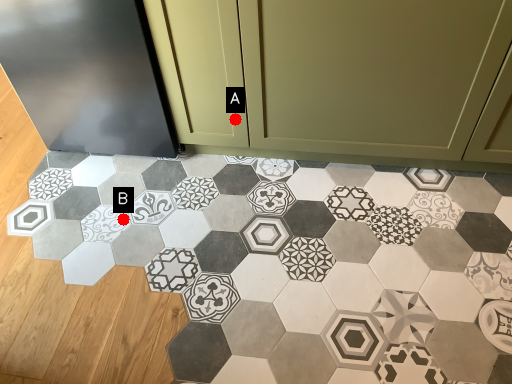
Question: Two points are circled on the image, labeled by A and B beside each circle. Which point is farther to the camera?

Choices:
 (A) A is further
 (B) B is further

Answer: (B)